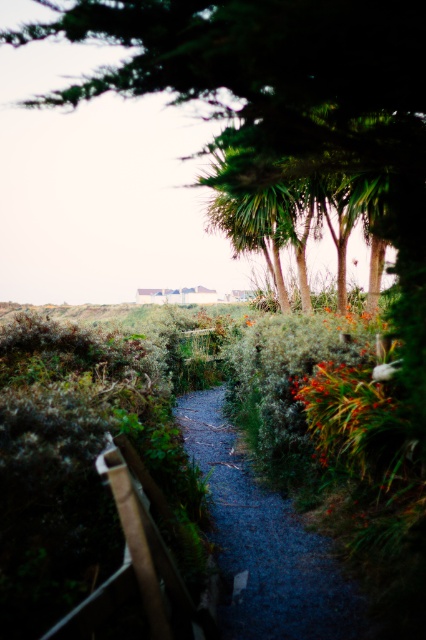
Which of these two, green leafy tree at upper center or green fuzzy plant at center, stands shorter?

green leafy tree at upper center

Is green leafy tree at upper center smaller than green fuzzy plant at center?

Yes.

Which is behind, point (117, 3) or point (322, 397)?

Point (117, 3)

The height and width of the screenshot is (640, 426). What are the coordinates of `green leafy tree at upper center` in the screenshot? It's located at (275, 83).

Can you confirm if dark gray gravel path at center is positioned below green fuzzy plant at center?

Yes.

From the picture: Can you confirm if dark gray gravel path at center is positioned to the right of green fuzzy plant at center?

No, dark gray gravel path at center is not to the right of green fuzzy plant at center.

Which is behind, point (325, 611) or point (363, 445)?

The point (363, 445) is more distant.

Locate an element on the screen. dark gray gravel path at center is located at coordinates (264, 545).

Which is more to the left, green leafy tree at upper center or dark gray gravel path at center?

green leafy tree at upper center

This screenshot has height=640, width=426. In order to click on green leafy tree at upper center in this screenshot , I will do `click(275, 83)`.

Identify the location of green leafy tree at upper center. The width and height of the screenshot is (426, 640). (275, 83).